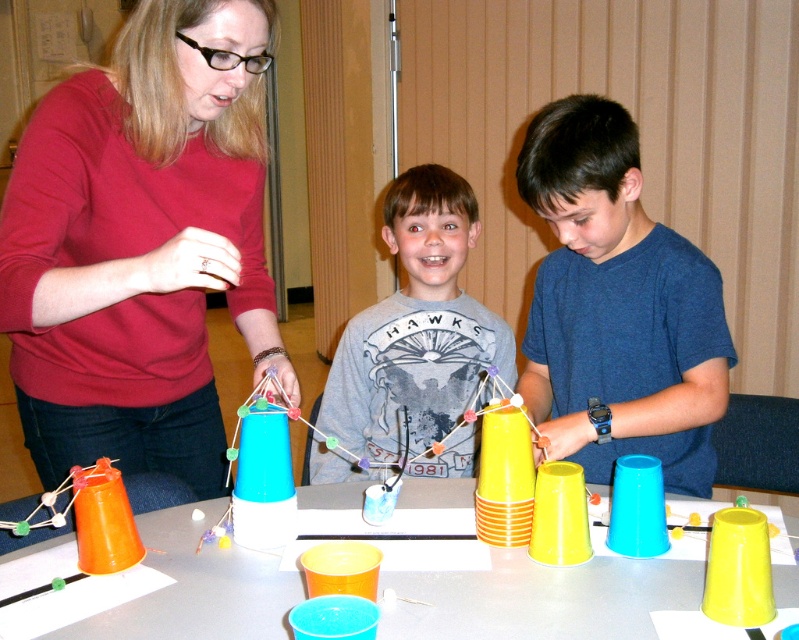
You are a photographer standing at the camera position. You want to place a blue matte cup at center closer to the camera so that it is now 3 feet away from the camera. How much distance do you need to move it?

The blue matte cup at center is currently 4.12 feet away from the camera. To move it to 3 feet away, you need to reduce the distance by 1.12 feet.

You are organizing a small workshop and need to place the blue matte cup at center on top of the gray matte shirt at center. Based on their sizes, will the cup fit stably on the shirt without slipping off?

The blue matte cup at center has a lesser width compared to the gray matte shirt at center, so it should fit stably on the shirt without slipping off since its base is narrower than the shirt.